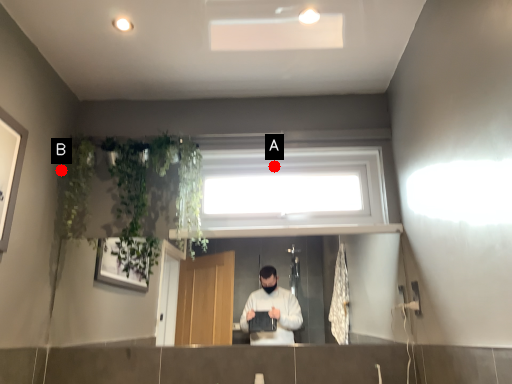
Question: Two points are circled on the image, labeled by A and B beside each circle. Which point is closer to the camera taking this photo?

Choices:
 (A) A is closer
 (B) B is closer

Answer: (B)